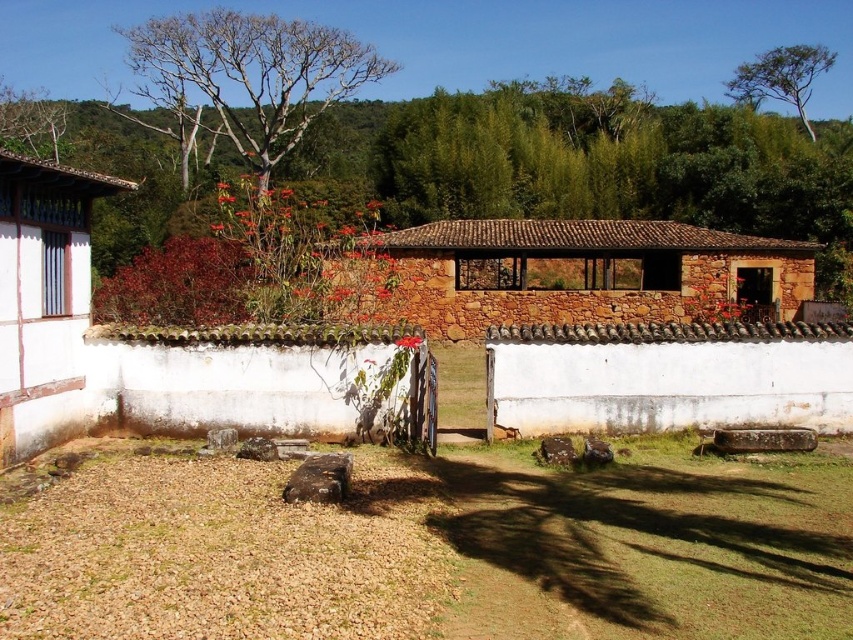
You are standing in the courtyard and want to place a large decorative rock in an area that has more space. Which area should you choose between the brown grass at lower center and the bare wood tree at upper left?

The bare wood tree at upper left has more space available compared to the brown grass at lower center, so you should choose the area near the bare wood tree at upper left.

You are standing in the courtyard and want to walk towards the green leafy tree at upper right. Which direction should you move relative to the brown grass at lower center?

You should move to the right relative to the brown grass at lower center because the green leafy tree at upper right is positioned on the right side of the brown grass at lower center.